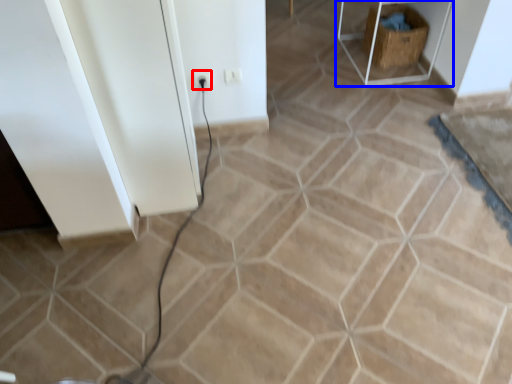
Question: Which point is closer to the camera, electric outlet (highlighted by a red box) or furniture (highlighted by a blue box)?

Choices:
 (A) electric outlet
 (B) furniture

Answer: (A)